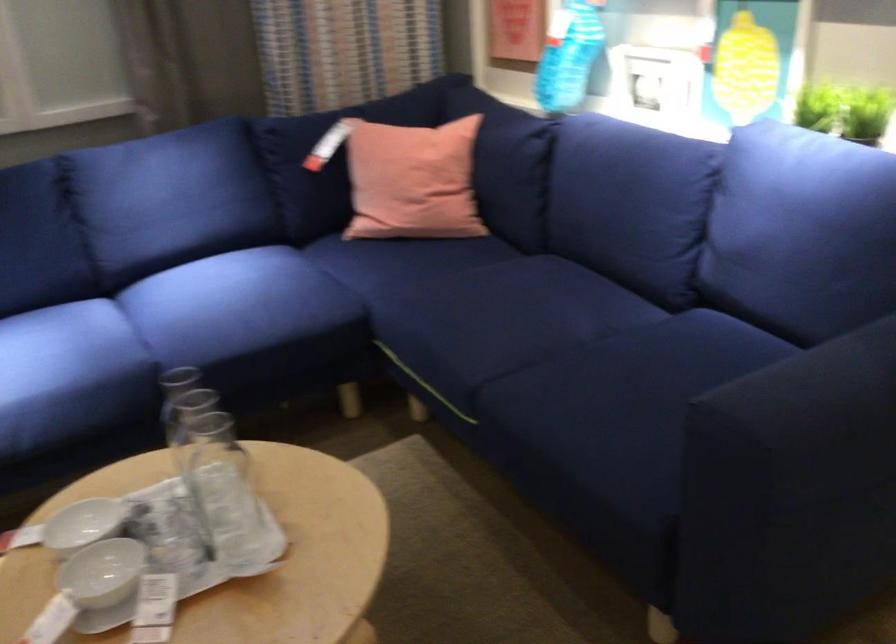
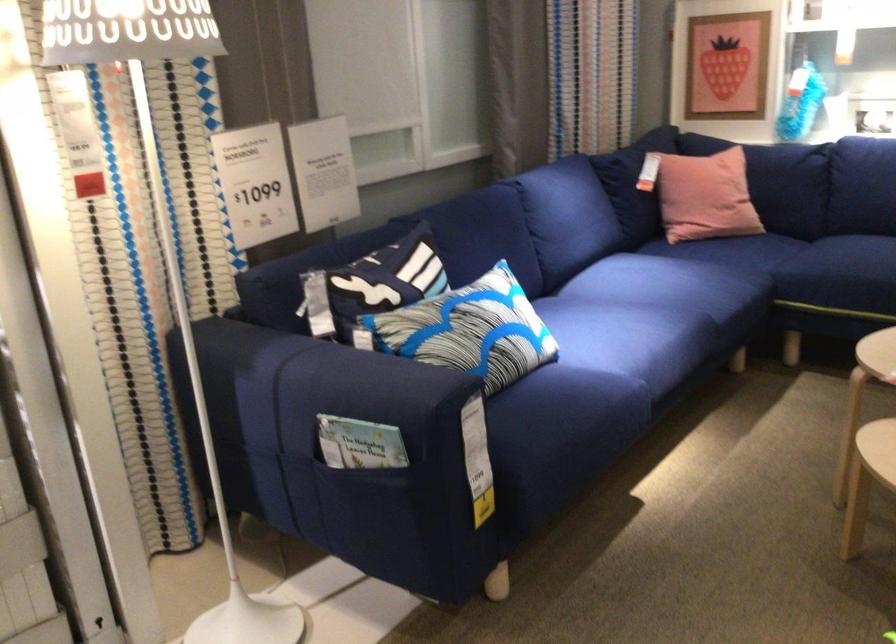
Find the pixel in the second image that matches pixel 151 339 in the first image.

(676, 303)